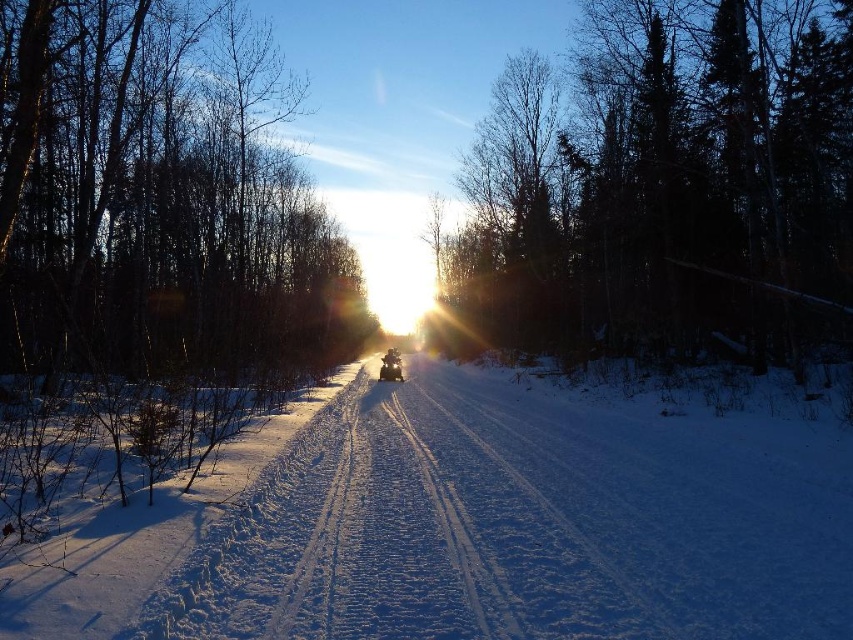
You are a photographer standing at the edge of the snowmobile trail. You want to take a photo that includes both the smooth bark tree at left and the metallic silver snowmobile at center. Which object should you focus on first to ensure both are in sharp focus?

The smooth bark tree at left is closer to the viewer than the metallic silver snowmobile at center, so you should focus on the smooth bark tree at left first to ensure both are in sharp focus.

You are a photographer standing at the camera position. You want to take a closeup shot of the white powdery snow at center. Considering the distance, is it possible to capture the snow clearly without moving closer?

The white powdery snow at center is 495.99 feet away from camera. At this distance, it would be challenging to capture clear details of the snow without moving closer or using specialized equipment like a telephoto lens.